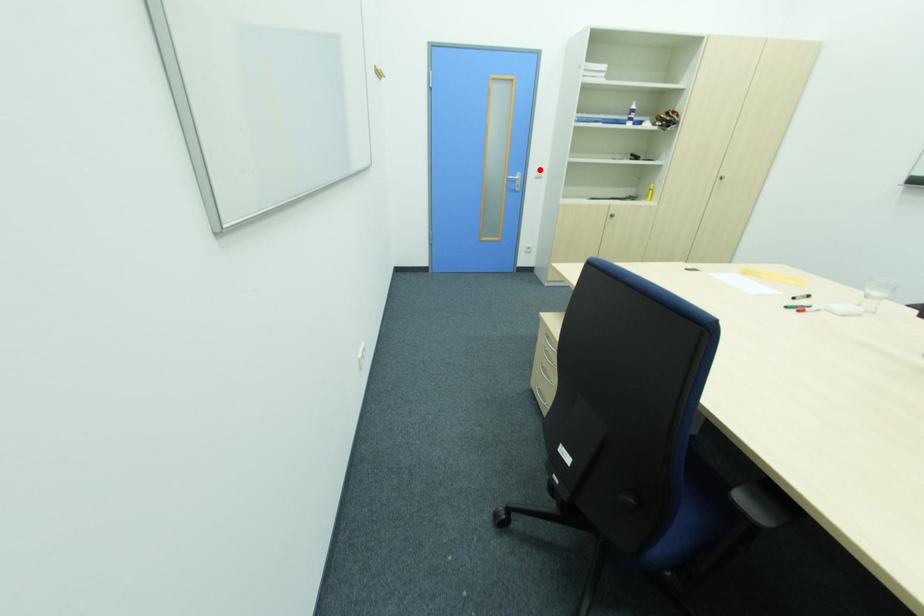
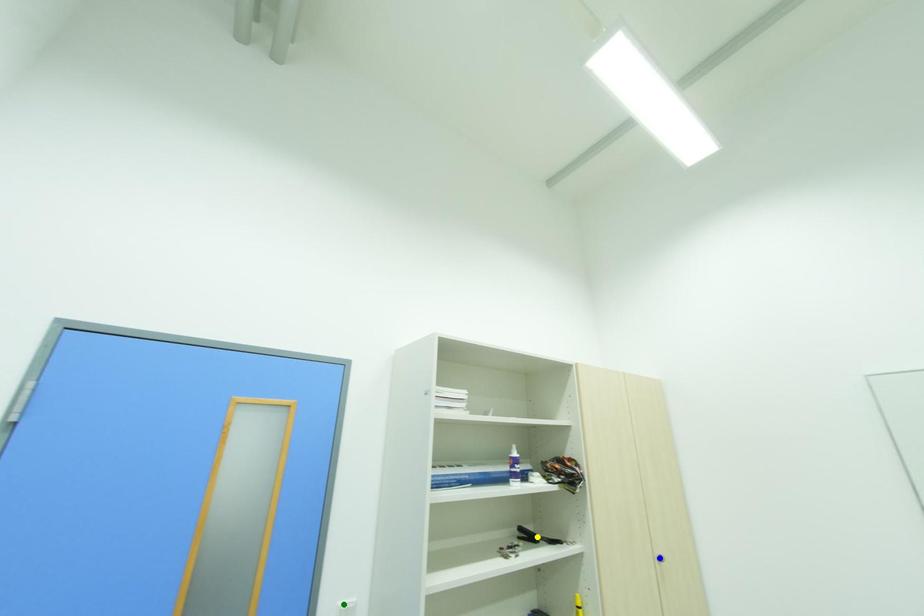
Question: I am providing you with two images of the same scene from different viewpoints. A red point is marked on the first image. You are given multiple points on the second image. In image 2, which mark is for the same physical point as the one in image 1?

Choices:
 (A) green point
 (B) blue point
 (C) yellow point

Answer: (A)